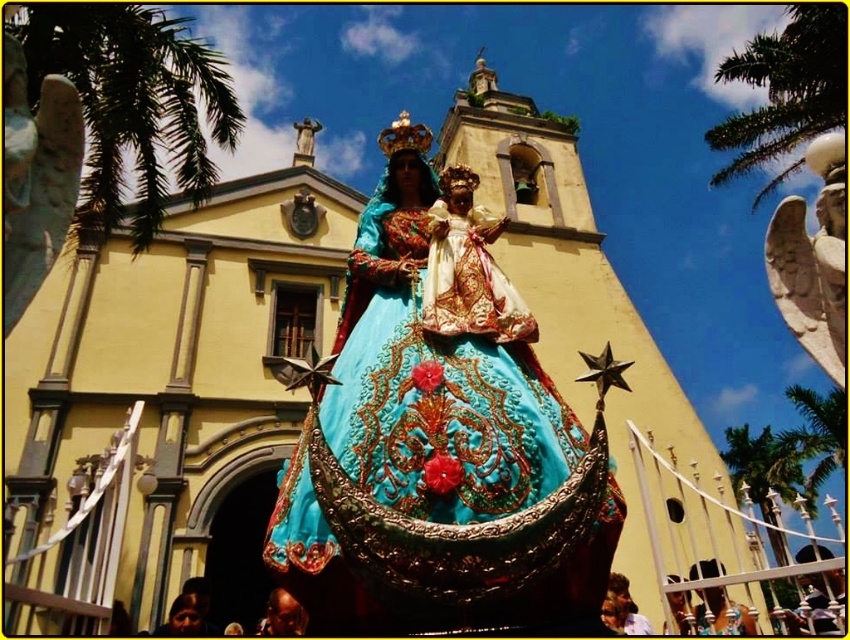
Is turquoise satin dress at center further to the viewer compared to green leafy palm tree at upper center?

No, it is not.

Looking at this image, is turquoise satin dress at center below green leafy palm tree at upper center?

No.

Does point (442, 548) lie behind point (792, 444)?

No, it is in front of (792, 444).

Where is `turquoise satin dress at center`? The height and width of the screenshot is (640, 850). turquoise satin dress at center is located at coordinates (439, 440).

Between point (55, 49) and point (837, 102), which one is positioned in front?

Point (55, 49)

Based on the photo, does green leafy palm tree at left have a greater height compared to green leafy palm tree at upper right?

Incorrect, green leafy palm tree at left's height is not larger of green leafy palm tree at upper right's.

Which is behind, point (68, 28) or point (758, 198)?

The point (758, 198) is behind.

This screenshot has height=640, width=850. In order to click on green leafy palm tree at left in this screenshot , I will do 132,104.

Is turquoise satin dress at center wider than green leafy palm tree at lower right?

No, turquoise satin dress at center is not wider than green leafy palm tree at lower right.

Where is `turquoise satin dress at center`? turquoise satin dress at center is located at coordinates (439, 440).

Image resolution: width=850 pixels, height=640 pixels. Find the location of `turquoise satin dress at center`. turquoise satin dress at center is located at coordinates (439, 440).